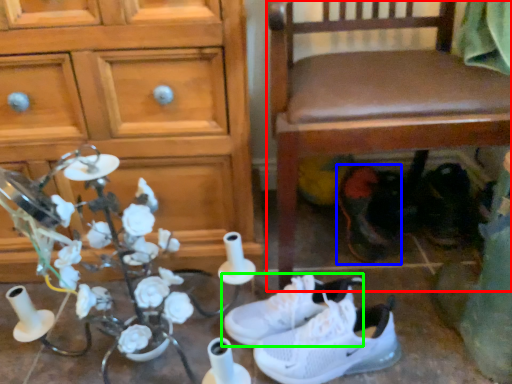
Question: Considering the real-world distances, which object is closest to chair (highlighted by a red box)? footwear (highlighted by a blue box) or footwear (highlighted by a green box).

Choices:
 (A) footwear
 (B) footwear

Answer: (A)